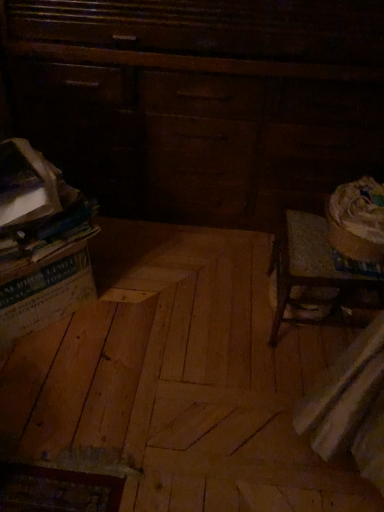
Question: Looking at their shapes, would you say dark wood dresser at upper left is wider or thinner than natural wood plywood at center?

Choices:
 (A) wide
 (B) thin

Answer: (B)

Question: In the image, is dark wood dresser at upper left positioned in front of or behind natural wood plywood at center?

Choices:
 (A) front
 (B) behind

Answer: (B)

Question: From a real-world perspective, is dark wood dresser at upper left physically located above or below natural wood plywood at center?

Choices:
 (A) below
 (B) above

Answer: (B)

Question: Is point (122, 429) closer or farther from the camera than point (130, 163)?

Choices:
 (A) closer
 (B) farther

Answer: (A)

Question: Choose the correct answer: Is natural wood plywood at center inside dark wood dresser at upper left or outside it?

Choices:
 (A) outside
 (B) inside

Answer: (A)

Question: In terms of size, does natural wood plywood at center appear bigger or smaller than dark wood dresser at upper left?

Choices:
 (A) small
 (B) big

Answer: (A)

Question: In terms of height, does natural wood plywood at center look taller or shorter compared to dark wood dresser at upper left?

Choices:
 (A) short
 (B) tall

Answer: (A)